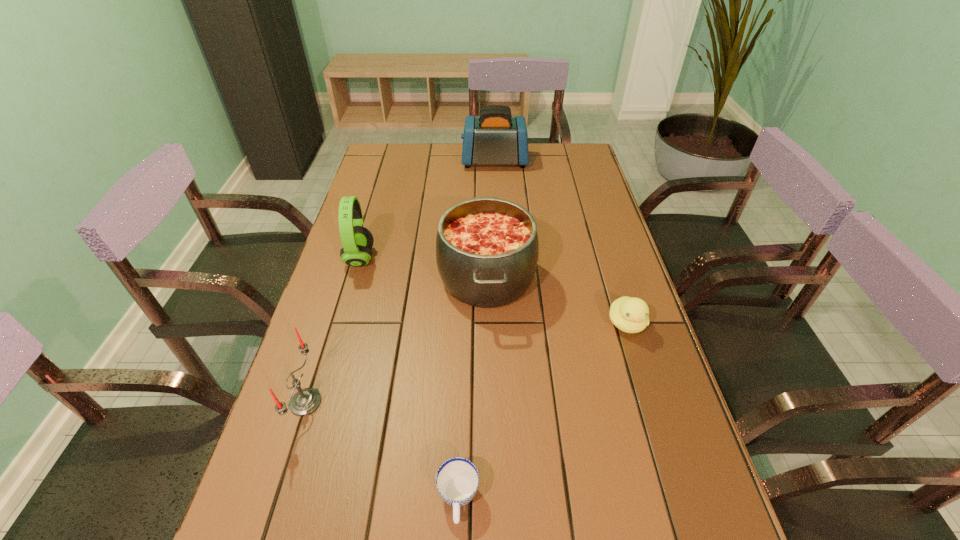
Where is `free spot located 0.280m on the front-facing side of the farthest object`? free spot located 0.280m on the front-facing side of the farthest object is located at coordinates (390, 161).

The width and height of the screenshot is (960, 540). I want to click on free location located 0.160m on the back of the headset, so (x=374, y=211).

Identify the location of vacant region located 0.080m on the front of the casserole. This screenshot has height=540, width=960. (488, 352).

Where is `vacant space located 0.170m on the front-facing side of the second nearest object`? The height and width of the screenshot is (540, 960). vacant space located 0.170m on the front-facing side of the second nearest object is located at coordinates (398, 402).

Find the location of a particular element. free space located at the beak of the duckling is located at coordinates point(680,495).

The image size is (960, 540). Find the location of `object at the far edge`. object at the far edge is located at coordinates (495, 137).

Where is `headset located at the left edge`? Image resolution: width=960 pixels, height=540 pixels. headset located at the left edge is located at coordinates (357, 241).

Locate an element on the screen. This screenshot has width=960, height=540. candle located in the left edge section of the desktop is located at coordinates (305, 401).

The width and height of the screenshot is (960, 540). I want to click on object positioned at the right edge, so click(x=630, y=315).

I want to click on free space at the far edge, so click(x=507, y=169).